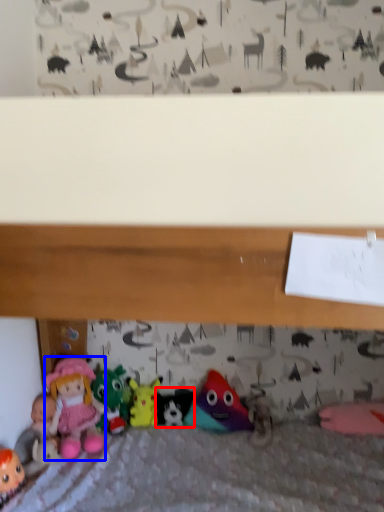
Question: Among these objects, which one is farthest to the camera, toy (highlighted by a red box) or doll (highlighted by a blue box)?

Choices:
 (A) toy
 (B) doll

Answer: (A)